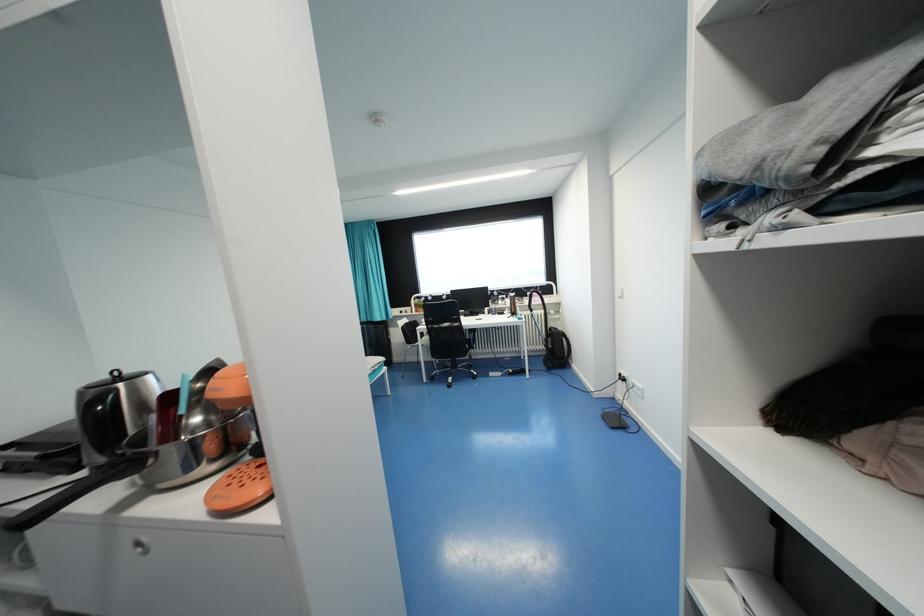
Where is `chair armrest`? Image resolution: width=924 pixels, height=616 pixels. chair armrest is located at coordinates (477, 342).